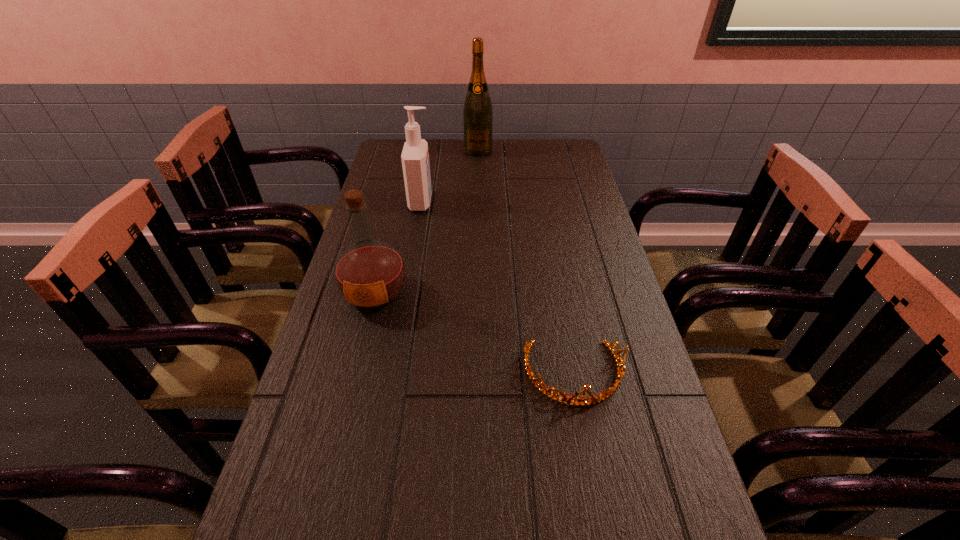
Where is `object that is at the far edge`? This screenshot has width=960, height=540. object that is at the far edge is located at coordinates (477, 113).

The image size is (960, 540). I want to click on cleansing agent that is at the left edge, so click(415, 157).

Where is `liquor that is at the left edge`? The image size is (960, 540). liquor that is at the left edge is located at coordinates (370, 274).

At what (x,y) coordinates should I click in order to perform the action: click on object at the right edge. Please return your answer as a coordinate pair (x, y). Looking at the image, I should click on pos(605,394).

Find the location of a particular element. The image size is (960, 540). vacant space at the far edge of the desktop is located at coordinates (468, 161).

What are the coordinates of `vacant space at the left edge of the desktop` in the screenshot? It's located at (330, 354).

The width and height of the screenshot is (960, 540). In the image, there is a desktop. In order to click on vacant region at the right edge in this screenshot , I will do `click(598, 211)`.

At what (x,y) coordinates should I click in order to perform the action: click on empty space that is in between the tiara and the second nearest object. Please return your answer as a coordinate pair (x, y). The height and width of the screenshot is (540, 960). Looking at the image, I should click on pos(474,334).

Where is `vacant area that lies between the rightmost object and the farthest object`? This screenshot has height=540, width=960. vacant area that lies between the rightmost object and the farthest object is located at coordinates (526, 262).

At what (x,y) coordinates should I click in order to perform the action: click on empty location between the nearest object and the cleansing agent. Please return your answer as a coordinate pair (x, y). The image size is (960, 540). Looking at the image, I should click on (497, 288).